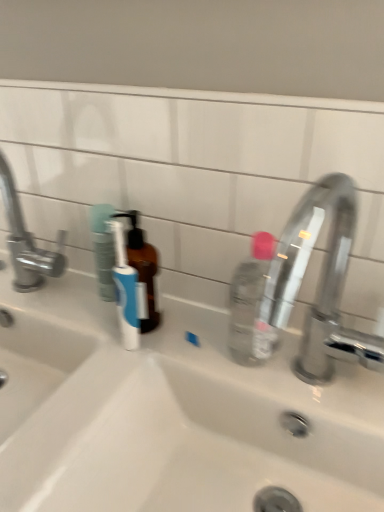
Question: Is brushed metal faucet at left, acting as the second tap starting from the right, next to polished chrome faucet at right, arranged as the 1th tap when viewed from the right, and touching it?

Choices:
 (A) no
 (B) yes

Answer: (A)

Question: From a real-world perspective, does brushed metal faucet at left, which is the first tap in left-to-right order, sit lower than polished chrome faucet at right, arranged as the 1th tap when viewed from the right?

Choices:
 (A) yes
 (B) no

Answer: (B)

Question: Is brushed metal faucet at left, which is the first tap in left-to-right order, not within polished chrome faucet at right, which is counted as the second tap, starting from the left?

Choices:
 (A) no
 (B) yes

Answer: (B)

Question: From the image's perspective, is brushed metal faucet at left, acting as the second tap starting from the right, beneath polished chrome faucet at right, arranged as the 1th tap when viewed from the right?

Choices:
 (A) no
 (B) yes

Answer: (A)

Question: From the image's perspective, does brushed metal faucet at left, which is the first tap in left-to-right order, appear higher than polished chrome faucet at right, arranged as the 1th tap when viewed from the right?

Choices:
 (A) no
 (B) yes

Answer: (B)

Question: From the image's perspective, relative to white ceramic sink at center, is brushed metal faucet at left, acting as the second tap starting from the right, above or below?

Choices:
 (A) below
 (B) above

Answer: (B)

Question: Based on their positions, is brushed metal faucet at left, acting as the second tap starting from the right, located to the left or right of white ceramic sink at center?

Choices:
 (A) right
 (B) left

Answer: (B)

Question: In terms of width, does brushed metal faucet at left, acting as the second tap starting from the right, look wider or thinner when compared to white ceramic sink at center?

Choices:
 (A) wide
 (B) thin

Answer: (B)

Question: In the image, is brushed metal faucet at left, acting as the second tap starting from the right, positioned in front of or behind white ceramic sink at center?

Choices:
 (A) front
 (B) behind

Answer: (B)

Question: In terms of size, does white ceramic sink at center appear bigger or smaller than polished chrome faucet at right, which is counted as the second tap, starting from the left?

Choices:
 (A) small
 (B) big

Answer: (B)

Question: Considering the positions of point (152, 377) and point (271, 274), is point (152, 377) closer or farther from the camera than point (271, 274)?

Choices:
 (A) closer
 (B) farther

Answer: (B)

Question: From their relative heights in the image, would you say white ceramic sink at center is taller or shorter than polished chrome faucet at right, which is counted as the second tap, starting from the left?

Choices:
 (A) short
 (B) tall

Answer: (B)

Question: Considering the positions of white ceramic sink at center and polished chrome faucet at right, which is counted as the second tap, starting from the left, in the image, is white ceramic sink at center wider or thinner than polished chrome faucet at right, which is counted as the second tap, starting from the left,?

Choices:
 (A) thin
 (B) wide

Answer: (B)

Question: Relative to brushed metal faucet at left, which is the first tap in left-to-right order, is polished chrome faucet at right, which is counted as the second tap, starting from the left, in front or behind?

Choices:
 (A) front
 (B) behind

Answer: (A)

Question: In terms of size, does polished chrome faucet at right, which is counted as the second tap, starting from the left, appear bigger or smaller than brushed metal faucet at left, acting as the second tap starting from the right?

Choices:
 (A) big
 (B) small

Answer: (A)